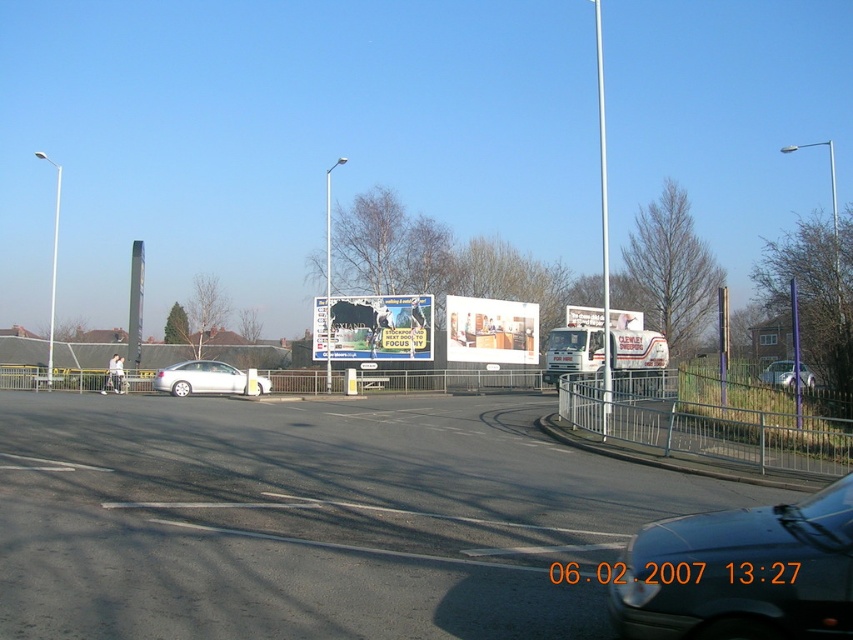
Does white glossy kitchen at center have a greater width compared to silver metallic sedan at center?

Correct, the width of white glossy kitchen at center exceeds that of silver metallic sedan at center.

Is point (476, 358) positioned behind point (767, 376)?

Yes.

Who is more forward, (x=463, y=339) or (x=782, y=372)?

Positioned in front is point (x=782, y=372).

Find the location of a particular element. Image resolution: width=853 pixels, height=640 pixels. white glossy kitchen at center is located at coordinates (491, 330).

Is point (312, 598) positioned in front of point (824, 602)?

No, it is behind (824, 602).

Is the position of black asphalt road at center less distant than that of shiny black car at lower right?

No, it is not.

Which is in front, point (163, 428) or point (842, 490)?

Point (842, 490) is more forward.

Where is `black asphalt road at center`? black asphalt road at center is located at coordinates tap(312, 518).

Can you confirm if satin silver sedan at center is thinner than matte white billboard at center?

Yes.

In the scene shown: Who is more distant from viewer, (207,378) or (596,323)?

The point (596,323) is more distant.

The width and height of the screenshot is (853, 640). In order to click on satin silver sedan at center in this screenshot , I will do `click(199, 378)`.